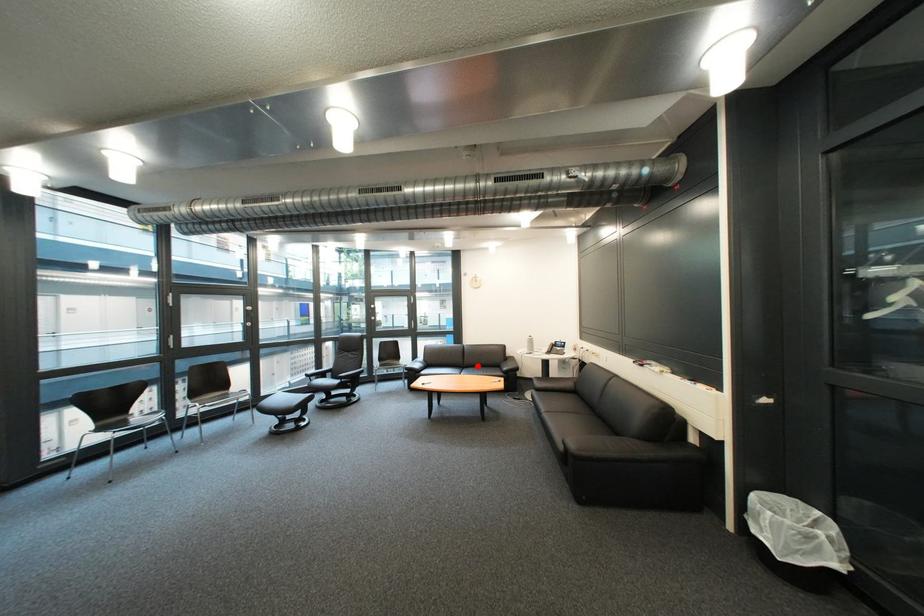
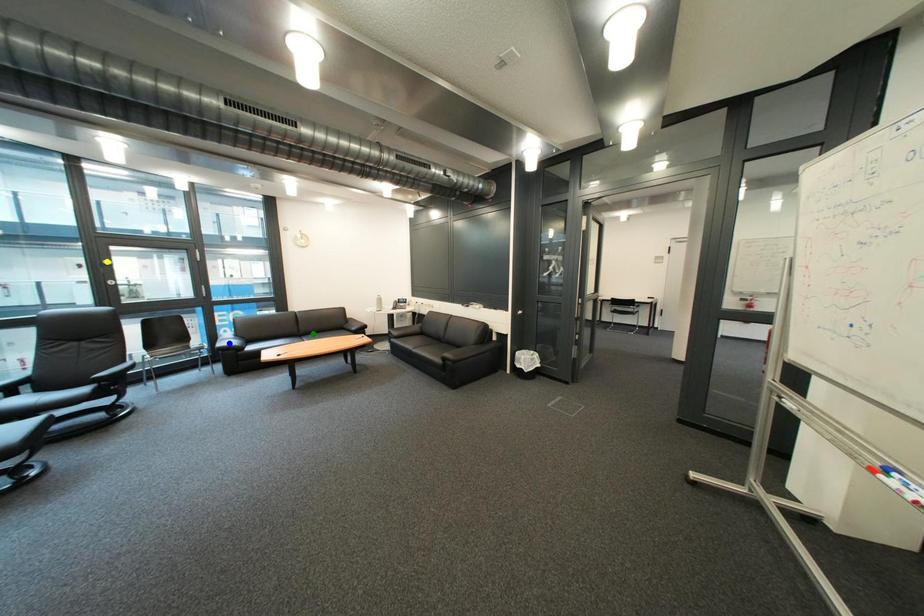
Question: I am providing you with two images of the same scene from different viewpoints. A red point is marked on the first image. You are given multiple points on the second image. Which point in image 2 represents the same 3d spot as the red point in image 1?

Choices:
 (A) green point
 (B) blue point
 (C) yellow point

Answer: (A)